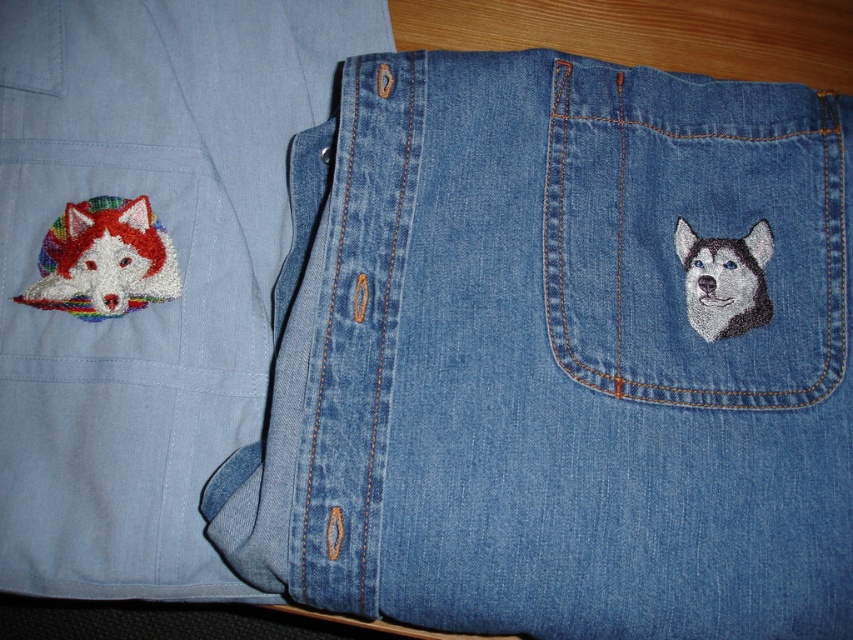
You are a fashion designer looking at the image of the two clothing items. You need to determine the spatial relationship between the denim at upper right and the white fur dog at upper right. Which one is positioned higher in the image?

The white fur dog at upper right is positioned higher than the denim at upper right because the denim at upper right is located below it.

You are standing in front of the two pieces of clothing and want to touch the point that is closer to you. Which point should you choose between point (x=78, y=584) and point (x=704, y=282)?

Point (x=78, y=584) is further to the viewer than point (x=704, y=282), so you should choose point (x=78, y=584) as it is closer to you.

You are a fashion designer trying to place a white fur dog at upper right onto the front pocket of the matte denim shirt at left. Based on their sizes, can the dog fit on the shirt?

The matte denim shirt at left might be wider than white fur dog at upper right, so there is a possibility that the dog could fit, but the exact dimensions are uncertain.